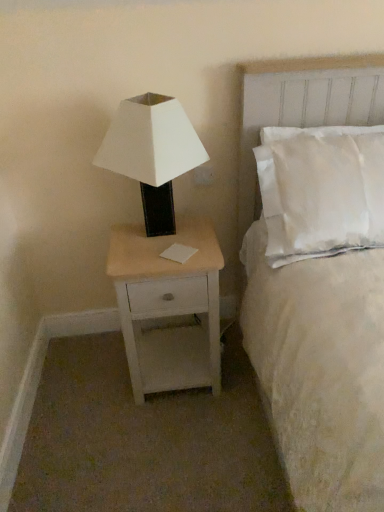
Question: Relative to white matte/black base lamp at left, is white soft bed at upper right in front or behind?

Choices:
 (A) behind
 (B) front

Answer: (B)

Question: In terms of height, does white soft bed at upper right look taller or shorter compared to white matte/black base lamp at left?

Choices:
 (A) short
 (B) tall

Answer: (B)

Question: Which object is positioned farthest from the white matte/black base lamp at left?

Choices:
 (A) white plastic electric outlet at upper right
 (B) white soft bed at upper right
 (C) light wood/white painted nightstand at lower left

Answer: (B)

Question: Based on their relative distances, which object is nearer to the light wood/white painted nightstand at lower left?

Choices:
 (A) white soft bed at upper right
 (B) white plastic electric outlet at upper right
 (C) white matte/black base lamp at left

Answer: (C)